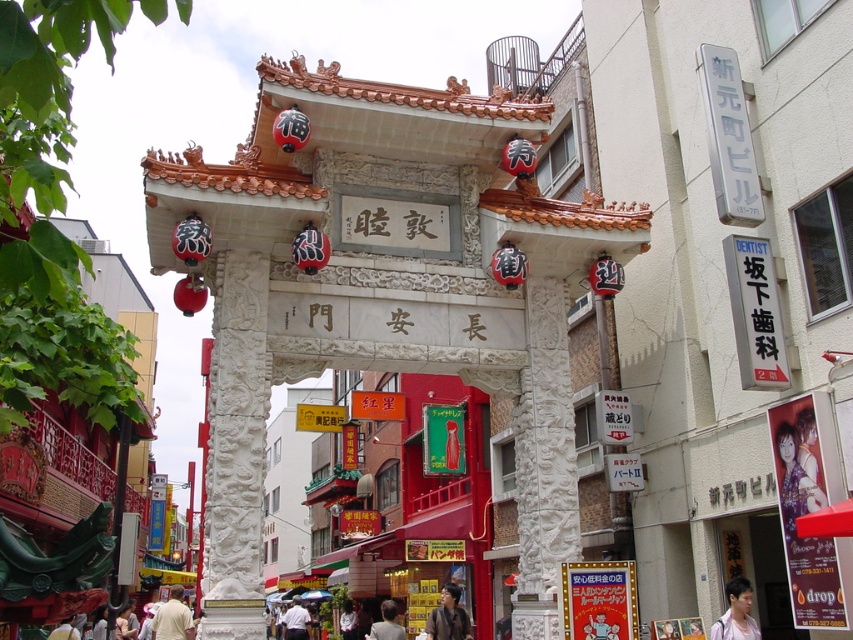
You are a photographer standing in front of the traditional Chinese archway. You notice a matte purple shirt at lower right and a smooth black hair at center. Which object is shorter in height?

The matte purple shirt at lower right is not as tall as the smooth black hair at center, so the matte purple shirt at lower right is shorter in height.

You are a photographer standing in front of the traditional Chinese archway. You notice two people wearing shirts in the scene. One is wearing a light beige shirt at lower center and the other a white shirt at center. From your perspective, which shirt is positioned to the left of the other?

The light beige shirt at lower center is positioned to the left of the white shirt at center.

You are a photographer standing at the entrance of the Chinatown archway. You want to take a photo that includes both the matte purple shirt at lower right and the white shirt at center. Given that your camera has a maximum focus range of 90 meters, will you be able to capture both shirts in focus without moving your position?

The matte purple shirt at lower right and white shirt at center are 92.00 meters apart from each other. Since the distance between them exceeds the camera maximum focus range of 90 meters, you will not be able to capture both shirts in focus without moving your position.